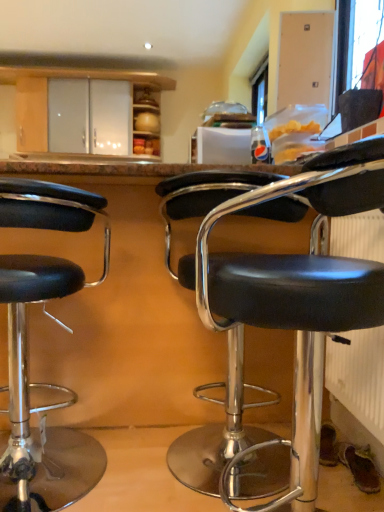
Locate an element on the screen. The height and width of the screenshot is (512, 384). white textured radiator at lower right is located at coordinates (359, 377).

This screenshot has width=384, height=512. What are the coordinates of `black leather stool at center, the 1th chair viewed from the right` in the screenshot? It's located at (275, 311).

Is the depth of black leather stool at left, arranged as the 2th chair when viewed from the right, greater than that of white textured radiator at lower right?

No, black leather stool at left, arranged as the 2th chair when viewed from the right, is closer to the camera.

How many degrees apart are the facing directions of black leather stool at left, arranged as the 2th chair when viewed from the right, and white textured radiator at lower right?

86.6 degrees.

From the image's perspective, is black leather stool at left, which is the 1th chair in left-to-right order, below white textured radiator at lower right?

Indeed, from the image's perspective, black leather stool at left, which is the 1th chair in left-to-right order, is shown beneath white textured radiator at lower right.

Is black leather stool at left, which is the 1th chair in left-to-right order, completely or partially outside of white textured radiator at lower right?

black leather stool at left, which is the 1th chair in left-to-right order, lies outside white textured radiator at lower right's area.

Is white textured radiator at lower right aimed at black leather stool at center, placed as the 2th chair when sorted from left to right?

No, white textured radiator at lower right does not turn towards black leather stool at center, placed as the 2th chair when sorted from left to right.

Considering the relative sizes of white textured radiator at lower right and black leather stool at center, placed as the 2th chair when sorted from left to right, in the image provided, is white textured radiator at lower right taller than black leather stool at center, placed as the 2th chair when sorted from left to right,?

No, white textured radiator at lower right is not taller than black leather stool at center, placed as the 2th chair when sorted from left to right.

From the image's perspective, which chair is the 2nd one below the white textured radiator at lower right? Please provide its 2D coordinates.

[(275, 311)]

Is white textured radiator at lower right touching black leather stool at center, placed as the 2th chair when sorted from left to right?

No.

How many degrees apart are the facing directions of black leather stool at left, which is the 1th chair in left-to-right order, and black leather stool at center, the 1th chair viewed from the right?

The angle between the facing direction of black leather stool at left, which is the 1th chair in left-to-right order, and the facing direction of black leather stool at center, the 1th chair viewed from the right, is 1.23 degrees.

Based on their sizes in the image, would you say black leather stool at left, arranged as the 2th chair when viewed from the right, is bigger or smaller than black leather stool at center, the 1th chair viewed from the right?

In the image, black leather stool at left, arranged as the 2th chair when viewed from the right, appears to be smaller than black leather stool at center, the 1th chair viewed from the right.

Is black leather stool at left, which is the 1th chair in left-to-right order, taller or shorter than black leather stool at center, the 1th chair viewed from the right?

Clearly, black leather stool at left, which is the 1th chair in left-to-right order, is shorter compared to black leather stool at center, the 1th chair viewed from the right.

Is black leather stool at left, which is the 1th chair in left-to-right order, far from black leather stool at center, the 1th chair viewed from the right?

They are positioned close to each other.

Based on their sizes in the image, would you say black leather stool at center, placed as the 2th chair when sorted from left to right, is bigger or smaller than white textured radiator at lower right?

Clearly, black leather stool at center, placed as the 2th chair when sorted from left to right, is larger in size than white textured radiator at lower right.

From the image's perspective, relative to white textured radiator at lower right, is black leather stool at center, the 1th chair viewed from the right, above or below?

Based on their image positions, black leather stool at center, the 1th chair viewed from the right, is located beneath white textured radiator at lower right.

Where is `radiator lying behind the black leather stool at center, placed as the 2th chair when sorted from left to right`? Image resolution: width=384 pixels, height=512 pixels. radiator lying behind the black leather stool at center, placed as the 2th chair when sorted from left to right is located at coordinates (359, 377).

Does black leather stool at center, placed as the 2th chair when sorted from left to right, lie in front of white textured radiator at lower right?

Yes, black leather stool at center, placed as the 2th chair when sorted from left to right, is in front of white textured radiator at lower right.

Between white textured radiator at lower right and black leather stool at left, which is the 1th chair in left-to-right order, which one has smaller size?

Smaller between the two is white textured radiator at lower right.

Is white textured radiator at lower right positioned with its back to black leather stool at left, which is the 1th chair in left-to-right order?

white textured radiator at lower right does not have its back to black leather stool at left, which is the 1th chair in left-to-right order.

Looking at this image, can you confirm if white textured radiator at lower right is shorter than black leather stool at left, arranged as the 2th chair when viewed from the right?

Yes, white textured radiator at lower right is shorter than black leather stool at left, arranged as the 2th chair when viewed from the right.

From the image's perspective, does white textured radiator at lower right appear lower than black leather stool at left, arranged as the 2th chair when viewed from the right?

Actually, white textured radiator at lower right appears above black leather stool at left, arranged as the 2th chair when viewed from the right, in the image.

Is black leather stool at center, placed as the 2th chair when sorted from left to right, thinner than black leather stool at left, arranged as the 2th chair when viewed from the right?

Correct, the width of black leather stool at center, placed as the 2th chair when sorted from left to right, is less than that of black leather stool at left, arranged as the 2th chair when viewed from the right.

Is black leather stool at center, placed as the 2th chair when sorted from left to right, oriented towards black leather stool at left, which is the 1th chair in left-to-right order?

No, black leather stool at center, placed as the 2th chair when sorted from left to right, is not turned towards black leather stool at left, which is the 1th chair in left-to-right order.

Is black leather stool at center, placed as the 2th chair when sorted from left to right, not close to black leather stool at left, arranged as the 2th chair when viewed from the right?

black leather stool at center, placed as the 2th chair when sorted from left to right, is near black leather stool at left, arranged as the 2th chair when viewed from the right, not far away.

Which chair is the 2nd one when counting from the left side of the white textured radiator at lower right? Please provide its 2D coordinates.

[(40, 406)]

From the white textured radiator at lower right, count 2nd chairs forward and point to it. Please provide its 2D coordinates.

[(275, 311)]

Based on their spatial positions, is black leather stool at center, placed as the 2th chair when sorted from left to right, or white textured radiator at lower right closer to black leather stool at left, which is the 1th chair in left-to-right order?

black leather stool at center, placed as the 2th chair when sorted from left to right, lies closer to black leather stool at left, which is the 1th chair in left-to-right order, than the other object.

Considering their positions, is black leather stool at center, the 1th chair viewed from the right, positioned closer to white textured radiator at lower right than black leather stool at left, which is the 1th chair in left-to-right order?

black leather stool at center, the 1th chair viewed from the right.

Looking at the image, which one is located closer to black leather stool at center, placed as the 2th chair when sorted from left to right, white textured radiator at lower right or black leather stool at left, which is the 1th chair in left-to-right order?

The object closer to black leather stool at center, placed as the 2th chair when sorted from left to right, is white textured radiator at lower right.

Looking at the image, which one is located further to black leather stool at center, the 1th chair viewed from the right, black leather stool at left, arranged as the 2th chair when viewed from the right, or white textured radiator at lower right?

black leather stool at left, arranged as the 2th chair when viewed from the right.

Which object lies further to the anchor point black leather stool at left, which is the 1th chair in left-to-right order, white textured radiator at lower right or black leather stool at center, the 1th chair viewed from the right?

Among the two, white textured radiator at lower right is located further to black leather stool at left, which is the 1th chair in left-to-right order.

When comparing their distances from white textured radiator at lower right, does black leather stool at left, which is the 1th chair in left-to-right order, or black leather stool at center, the 1th chair viewed from the right, seem closer?

black leather stool at center, the 1th chair viewed from the right, is closer to white textured radiator at lower right.

Locate an element on the screen. The height and width of the screenshot is (512, 384). chair between black leather stool at left, which is the 1th chair in left-to-right order, and white textured radiator at lower right is located at coordinates (275, 311).